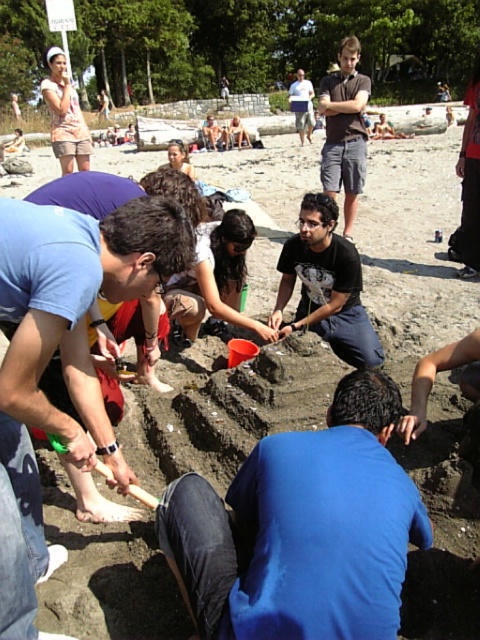
You are a photographer trying to capture a photo of the dark gray shorts at center and the red shirt at upper right. Based on their positions, which one should you focus on first to ensure both are in the frame?

The dark gray shorts at center is above the red shirt at upper right, so you should focus on the red shirt at upper right first to ensure both are in the frame.